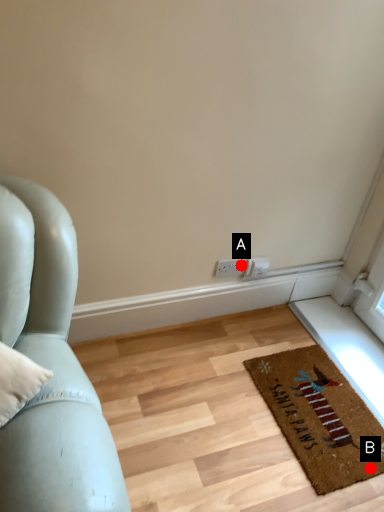
Question: Two points are circled on the image, labeled by A and B beside each circle. Which point is closer to the camera?

Choices:
 (A) A is closer
 (B) B is closer

Answer: (B)